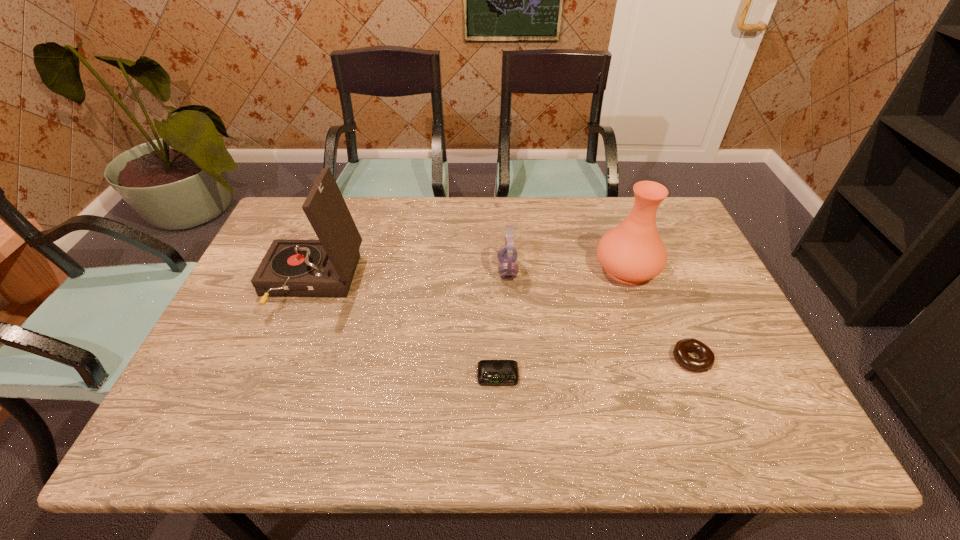
Where is `free space between the fourth tallest object and the headset`? free space between the fourth tallest object and the headset is located at coordinates (599, 315).

What are the coordinates of `object that stands as the third closest to the vase` in the screenshot? It's located at (490, 372).

Where is `the fourth closest object to the shortest object`? This screenshot has width=960, height=540. the fourth closest object to the shortest object is located at coordinates (707, 358).

The height and width of the screenshot is (540, 960). What are the coordinates of `vacant space that satisfies the following two spatial constraints: 1. on the front side of the fourth tallest object; 2. on the right side of the vase` in the screenshot? It's located at (659, 359).

Locate an element on the screen. The image size is (960, 540). free location that satisfies the following two spatial constraints: 1. on the front side of the vase; 2. on the headband and ear cups of the third shortest object is located at coordinates (628, 270).

Image resolution: width=960 pixels, height=540 pixels. Identify the location of free space that satisfies the following two spatial constraints: 1. on the back side of the phonograph record; 2. on the left side of the vase. (317, 268).